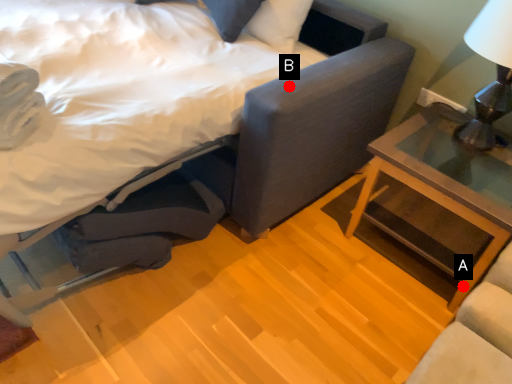
Question: Two points are circled on the image, labeled by A and B beside each circle. Which point is closer to the camera?

Choices:
 (A) A is closer
 (B) B is closer

Answer: (A)